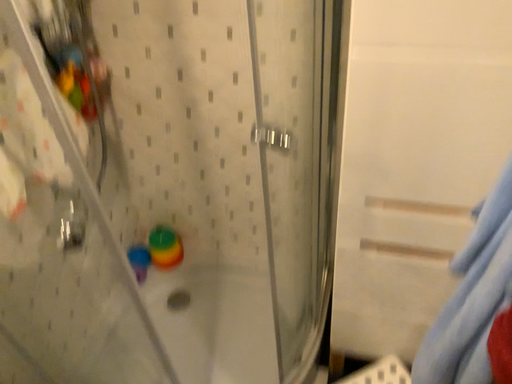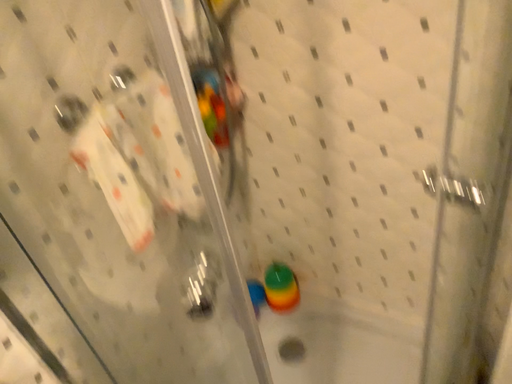
Question: How did the camera likely rotate when shooting the video?

Choices:
 (A) rotated right
 (B) rotated left

Answer: (B)